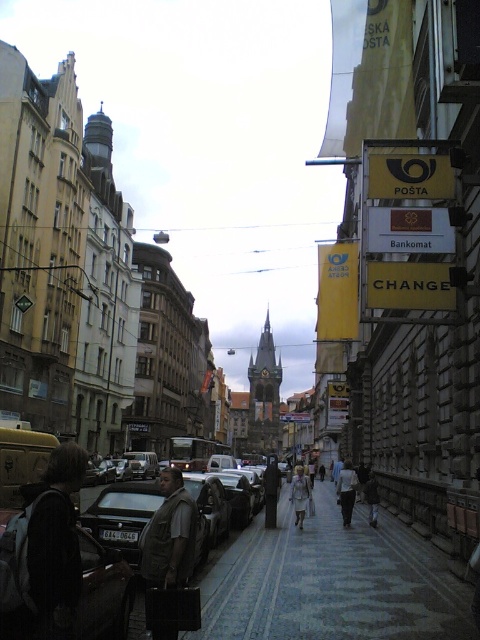
Question: Where is paved stone sidewalk at center located in relation to light gray fabric dress at center in the image?

Choices:
 (A) right
 (B) left

Answer: (B)

Question: Which point appears closest to the camera in this image?

Choices:
 (A) (348, 474)
 (B) (155, 566)
 (C) (462, 589)

Answer: (B)

Question: Is brown fabric backpack at center thinner than dark gray jacket at center?

Choices:
 (A) no
 (B) yes

Answer: (A)

Question: Which point is farther to the camera?

Choices:
 (A) (364, 513)
 (B) (180, 502)

Answer: (A)

Question: Can you confirm if brown fabric backpack at center is positioned to the right of light gray fabric dress at center?

Choices:
 (A) no
 (B) yes

Answer: (A)

Question: Which point is closer to the camera?

Choices:
 (A) dark gray jacket at center
 (B) brown fabric backpack at center
 (C) light gray fabric dress at center
 (D) paved stone sidewalk at center

Answer: (D)